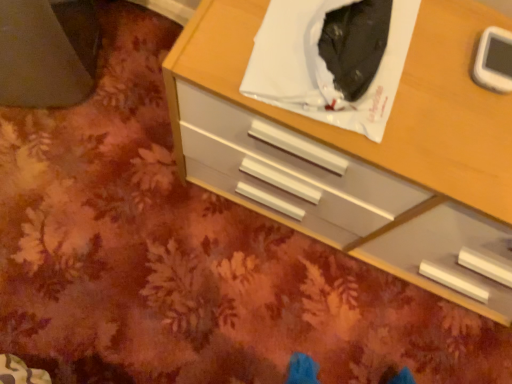
Identify the location of vacant space in front of wooden chest of drawers at upper center. (287, 314).